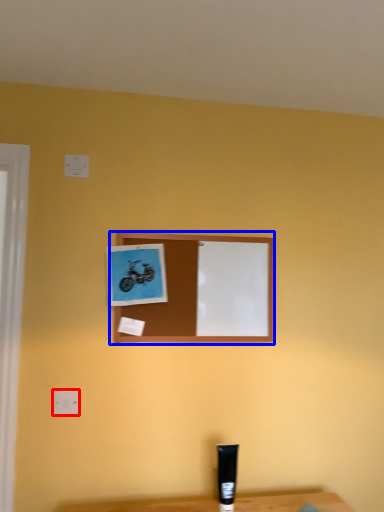
Question: Which object appears farthest to the camera in this image, electric outlet (highlighted by a red box) or picture frame (highlighted by a blue box)?

Choices:
 (A) electric outlet
 (B) picture frame

Answer: (B)